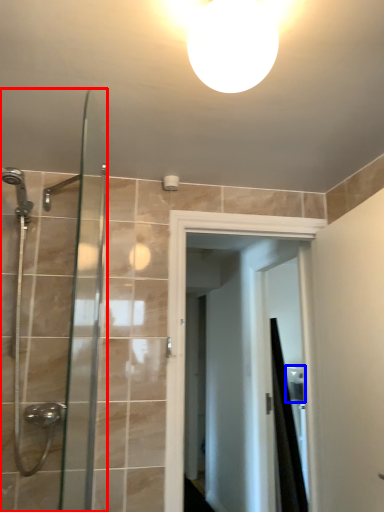
Question: Which of the following is the farthest to the observer, shower door (highlighted by a red box) or sink (highlighted by a blue box)?

Choices:
 (A) shower door
 (B) sink

Answer: (B)